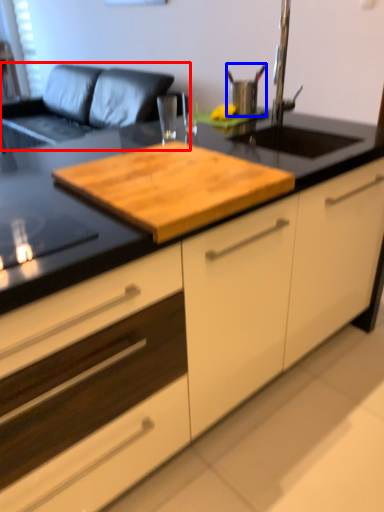
Question: Which object appears closest to the camera in this image, couch (highlighted by a red box) or appliance (highlighted by a blue box)?

Choices:
 (A) couch
 (B) appliance

Answer: (B)